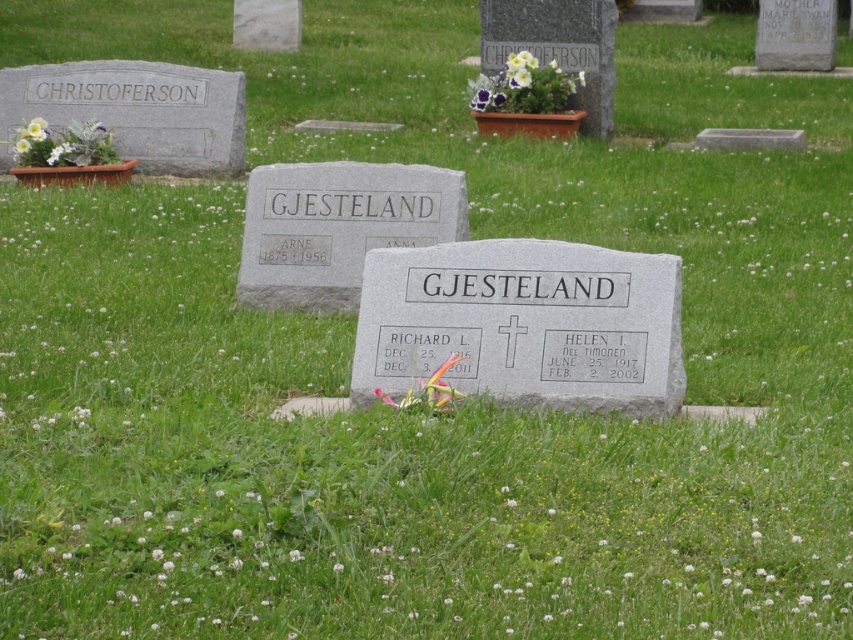
Is gray granite gravestone at center thinner than purple fabric flower at upper center?

No, gray granite gravestone at center is not thinner than purple fabric flower at upper center.

Does point (274, 253) come in front of point (543, 112)?

Yes, point (274, 253) is closer to viewer.

This screenshot has height=640, width=853. What do you see at coordinates (338, 227) in the screenshot?
I see `gray granite gravestone at center` at bounding box center [338, 227].

Locate an element on the screen. This screenshot has width=853, height=640. gray granite gravestone at center is located at coordinates (338, 227).

Does gray polished stone gravestone at center have a greater width compared to purple fabric flower at upper center?

Correct, the width of gray polished stone gravestone at center exceeds that of purple fabric flower at upper center.

Does gray polished stone gravestone at center have a lesser width compared to purple fabric flower at upper center?

Incorrect, gray polished stone gravestone at center's width is not less than purple fabric flower at upper center's.

Where is `gray polished stone gravestone at center`? This screenshot has height=640, width=853. gray polished stone gravestone at center is located at coordinates (524, 323).

Which of these two, gray polished stone gravestone at center or gray granite gravestone at center, stands shorter?

gray polished stone gravestone at center

Between point (619, 300) and point (410, 244), which one is positioned behind?

The point (410, 244) is more distant.

This screenshot has height=640, width=853. What do you see at coordinates (524, 323) in the screenshot?
I see `gray polished stone gravestone at center` at bounding box center [524, 323].

At what (x,y) coordinates should I click in order to perform the action: click on gray polished stone gravestone at center. Please return your answer as a coordinate pair (x, y). The height and width of the screenshot is (640, 853). Looking at the image, I should click on (524, 323).